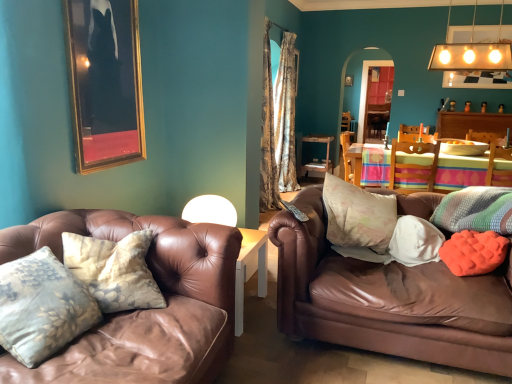
Locate an element on the screen. Image resolution: width=512 pixels, height=384 pixels. white matte lampshade at center, positioned as the second lamp in right-to-left order is located at coordinates (210, 210).

The width and height of the screenshot is (512, 384). What do you see at coordinates (474, 252) in the screenshot? I see `orange fabric pillow at right, acting as the third pillow starting from the right` at bounding box center [474, 252].

The image size is (512, 384). What are the coordinates of `wooden chair at center` in the screenshot? It's located at (413, 165).

What do you see at coordinates (42, 307) in the screenshot?
I see `light blue floral pillow at lower left, the 6th pillow in the right-to-left sequence` at bounding box center [42, 307].

Locate an element on the screen. This screenshot has width=512, height=384. orange fabric pillow at right, the 1th pillow positioned from the back is located at coordinates (463, 147).

Considering the sizes of orange fabric pillow at right, acting as the third pillow starting from the right, and light blue floral pillow at lower left, acting as the sixth pillow starting from the back, in the image, is orange fabric pillow at right, acting as the third pillow starting from the right, taller or shorter than light blue floral pillow at lower left, acting as the sixth pillow starting from the back,?

In the image, orange fabric pillow at right, acting as the third pillow starting from the right, appears to be shorter than light blue floral pillow at lower left, acting as the sixth pillow starting from the back.

From a real-world perspective, between orange fabric pillow at right, acting as the third pillow starting from the right, and light blue floral pillow at lower left, the first pillow when ordered from front to back, who is vertically higher?

light blue floral pillow at lower left, the first pillow when ordered from front to back.

Is orange fabric pillow at right, which is the fourth pillow in left-to-right order, facing away from light blue floral pillow at lower left, the 6th pillow in the right-to-left sequence?

No, orange fabric pillow at right, which is the fourth pillow in left-to-right order, is not facing the opposite direction of light blue floral pillow at lower left, the 6th pillow in the right-to-left sequence.

Is orange fabric pillow at right, arranged as the second pillow when viewed from the front, not near light blue floral pillow at lower left, which is the 1th pillow from left to right?

Absolutely, orange fabric pillow at right, arranged as the second pillow when viewed from the front, is distant from light blue floral pillow at lower left, which is the 1th pillow from left to right.

Is wooden table at center, the second table viewed from the back, taller or shorter than orange fabric pillow at right, which is the fourth pillow in left-to-right order?

Considering their sizes, wooden table at center, the second table viewed from the back, has more height than orange fabric pillow at right, which is the fourth pillow in left-to-right order.

Does point (447, 156) lie behind point (457, 273)?

Yes, point (447, 156) is behind point (457, 273).

From the picture: From a real-world perspective, is wooden table at center, which is the first table in front-to-back order, below orange fabric pillow at right, arranged as the second pillow when viewed from the front?

Correct, in the physical world, wooden table at center, which is the first table in front-to-back order, is lower than orange fabric pillow at right, arranged as the second pillow when viewed from the front.

Can you confirm if wooden table at center, the second table viewed from the back, is positioned to the right of orange fabric pillow at right, acting as the 1th pillow starting from the right?

No, wooden table at center, the second table viewed from the back, is not to the right of orange fabric pillow at right, acting as the 1th pillow starting from the right.

Considering the relative sizes of wooden table at center, which is the first table in front-to-back order, and orange fabric pillow at right, the sixth pillow in the front-to-back sequence, in the image provided, is wooden table at center, which is the first table in front-to-back order, thinner than orange fabric pillow at right, the sixth pillow in the front-to-back sequence,?

In fact, wooden table at center, which is the first table in front-to-back order, might be wider than orange fabric pillow at right, the sixth pillow in the front-to-back sequence.

Is wooden table at center, the second table viewed from the back, turned away from orange fabric pillow at right, which is the 6th pillow from left to right?

No, wooden table at center, the second table viewed from the back, is not facing the opposite direction of orange fabric pillow at right, which is the 6th pillow from left to right.

From a real-world perspective, is wooden table at center, which is the first table in front-to-back order, above or below orange fabric pillow at right, which is the 6th pillow from left to right?

wooden table at center, which is the first table in front-to-back order, is below orange fabric pillow at right, which is the 6th pillow from left to right.

Would you say camouflage fabric curtain at center is inside or outside orange fabric pillow at right, arranged as the second pillow when viewed from the front?

camouflage fabric curtain at center exists outside the volume of orange fabric pillow at right, arranged as the second pillow when viewed from the front.

From the image's perspective, which is above, camouflage fabric curtain at center or orange fabric pillow at right, which is the fourth pillow in left-to-right order?

camouflage fabric curtain at center appears higher in the image.

Does point (263, 209) lie in front of point (462, 263)?

That is False.

Between camouflage fabric curtain at center and orange fabric pillow at right, arranged as the second pillow when viewed from the front, which one is positioned behind?

camouflage fabric curtain at center is further away from the camera.

Is point (490, 190) positioned after point (440, 149)?

No, (490, 190) is closer to viewer.

Between orange textured pillow at right, which appears as the fifth pillow when viewed from the left, and orange fabric pillow at right, which is the 6th pillow from left to right, which one appears on the right side from the viewer's perspective?

orange fabric pillow at right, which is the 6th pillow from left to right.

Between orange textured pillow at right, arranged as the 2th pillow when viewed from the right, and orange fabric pillow at right, the 1th pillow positioned from the back, which one has more height?

orange textured pillow at right, arranged as the 2th pillow when viewed from the right, is taller.

Is orange textured pillow at right, placed as the third pillow when sorted from front to back, next to orange fabric pillow at right, acting as the 1th pillow starting from the right, and touching it?

No, orange textured pillow at right, placed as the third pillow when sorted from front to back, is not touching orange fabric pillow at right, acting as the 1th pillow starting from the right.

What's the angular difference between wooden chair at center and matte white light fixture at upper right, which is the second lamp from bottom to top,'s facing directions?

wooden chair at center and matte white light fixture at upper right, which is the second lamp from bottom to top, are facing 0.347 degrees away from each other.

Is wooden chair at center far away from matte white light fixture at upper right, the 2th lamp viewed from the front?

Yes, wooden chair at center and matte white light fixture at upper right, the 2th lamp viewed from the front, are quite far apart.

Is wooden chair at center shorter than matte white light fixture at upper right, the first lamp from the right?

Indeed, wooden chair at center has a lesser height compared to matte white light fixture at upper right, the first lamp from the right.

Is wooden chair at center positioned with its back to matte white light fixture at upper right, the 2th lamp viewed from the front?

No, wooden chair at center is not facing away from matte white light fixture at upper right, the 2th lamp viewed from the front.

In the scene shown: Which object is closer to the camera, gold-framed picture at upper left or orange textured pillow at right, placed as the third pillow when sorted from front to back?

Positioned in front is gold-framed picture at upper left.

From a real-world perspective, is gold-framed picture at upper left located beneath orange textured pillow at right, which appears as the fourth pillow when viewed from the back?

No, from a real-world perspective, gold-framed picture at upper left is not beneath orange textured pillow at right, which appears as the fourth pillow when viewed from the back.

Is gold-framed picture at upper left positioned with its back to orange textured pillow at right, arranged as the 2th pillow when viewed from the right?

No, gold-framed picture at upper left's orientation is not away from orange textured pillow at right, arranged as the 2th pillow when viewed from the right.

Is gold-framed picture at upper left bigger or smaller than orange textured pillow at right, which appears as the fifth pillow when viewed from the left?

In the image, gold-framed picture at upper left appears to be smaller than orange textured pillow at right, which appears as the fifth pillow when viewed from the left.

Where is `pillow in front of the orange fabric pillow at right, which is the fourth pillow in left-to-right order`? This screenshot has height=384, width=512. pillow in front of the orange fabric pillow at right, which is the fourth pillow in left-to-right order is located at coordinates (42, 307).

From the image's perspective, count 1st tables upward from the orange fabric pillow at right, the fifth pillow viewed from the back, and point to it. Please provide its 2D coordinates.

[(460, 171)]

When comparing their distances from wooden table at center, the second table viewed from the back, does orange textured pillow at right, arranged as the 2th pillow when viewed from the right, or camouflage fabric curtain at center seem closer?

camouflage fabric curtain at center lies closer to wooden table at center, the second table viewed from the back, than the other object.

From the image, which object appears to be nearer to wooden chair at center, white fabric pillow at right, which appears as the third pillow when viewed from the left, or white matte lampshade at center, the second lamp in the top-to-bottom sequence?

white fabric pillow at right, which appears as the third pillow when viewed from the left.

Looking at the image, which one is located further to orange fabric pillow at right, acting as the third pillow starting from the right, wooden table at center, the first table viewed from the back, or matte white light fixture at upper right, which appears as the second lamp when viewed from the left?

wooden table at center, the first table viewed from the back, is positioned further to the anchor orange fabric pillow at right, acting as the third pillow starting from the right.

Based on their spatial positions, is gold-framed picture at upper left or wooden table at center, marked as the second table in a front-to-back arrangement, closer to fluffy cotton pillow at center, which ranks as the second pillow in back-to-front order?

gold-framed picture at upper left.

Estimate the real-world distances between objects in this image. Which object is closer to orange fabric pillow at right, which is the fourth pillow in left-to-right order, orange textured pillow at right, which appears as the fourth pillow when viewed from the back, or light blue floral pillow at lower left, the first pillow when ordered from front to back?

Among the two, orange textured pillow at right, which appears as the fourth pillow when viewed from the back, is located nearer to orange fabric pillow at right, which is the fourth pillow in left-to-right order.

When comparing their distances from wooden table at center, which is the first table in front-to-back order, does matte white light fixture at upper right, the 2th lamp viewed from the front, or camouflage fabric curtain at center seem further?

camouflage fabric curtain at center.

Estimate the real-world distances between objects in this image. Which object is closer to orange fabric pillow at right, which is the fourth pillow in left-to-right order, orange textured pillow at right, which appears as the fifth pillow when viewed from the left, or wooden chair at center?

orange textured pillow at right, which appears as the fifth pillow when viewed from the left.

Based on their spatial positions, is white matte lampshade at center, the second lamp in the top-to-bottom sequence, or orange fabric pillow at right, the 1th pillow positioned from the back, further from wooden table at center, which is the first table in front-to-back order?

white matte lampshade at center, the second lamp in the top-to-bottom sequence, is further to wooden table at center, which is the first table in front-to-back order.

At what (x,y) coordinates should I click in order to perform the action: click on chair between brown leather couch at right and wooden table at center, the first table viewed from the back, in the front-back direction. Please return your answer as a coordinate pair (x, y). The height and width of the screenshot is (384, 512). Looking at the image, I should click on (413, 165).

Find the location of a particular element. pillow between white fabric pillow at right, positioned as the third pillow in back-to-front order, and orange fabric pillow at right, acting as the 1th pillow starting from the right, along the z-axis is located at coordinates (359, 220).

Where is `table between white matte lampshade at center, positioned as the second lamp in right-to-left order, and wooden table at center, marked as the second table in a front-to-back arrangement, in the front-back direction`? The image size is (512, 384). table between white matte lampshade at center, positioned as the second lamp in right-to-left order, and wooden table at center, marked as the second table in a front-to-back arrangement, in the front-back direction is located at coordinates (460, 171).

Where is `studio couch between light blue floral pillow at lower left, the 6th pillow in the right-to-left sequence, and matte white light fixture at upper right, which is the second lamp from bottom to top, from left to right`? The image size is (512, 384). studio couch between light blue floral pillow at lower left, the 6th pillow in the right-to-left sequence, and matte white light fixture at upper right, which is the second lamp from bottom to top, from left to right is located at coordinates (388, 300).